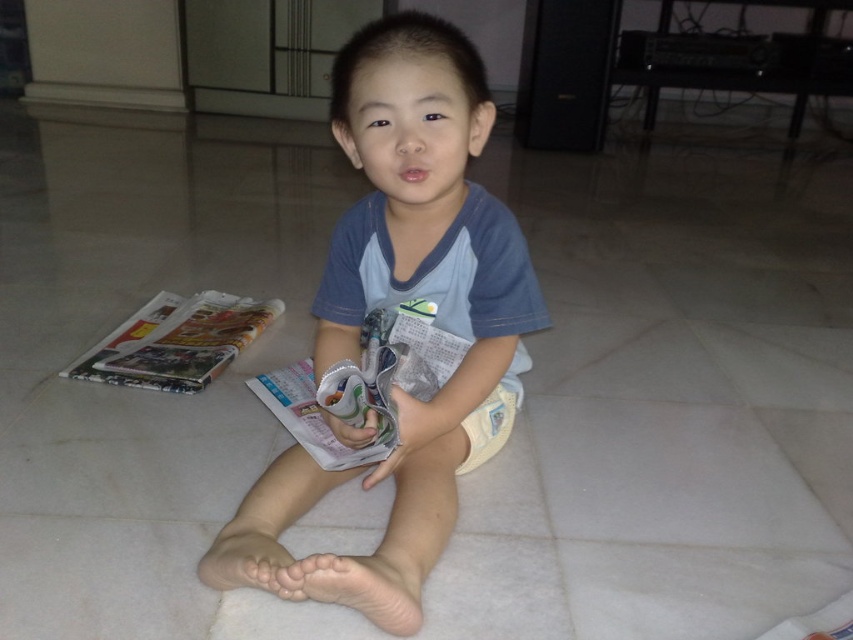
What object is located at the coordinates point (363, 385) in the scene?

The point (363, 385) corresponds to the printed paper magazine at center.

You are a parent trying to locate your child who is sitting on the floor. You remember seeing two printed paper magazines. Where would the printed paper magazine at center be in relation to the printed paper magazine at left?

The printed paper magazine at center is in front of the printed paper magazine at left.